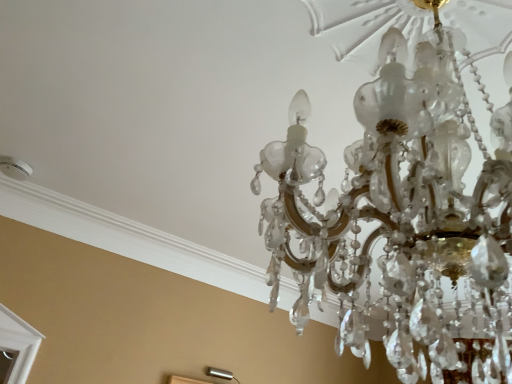
Question: Which direction should I rotate to look at silver metallic lamp at lower center, acting as the 2th lamp starting from the front, — up or down?

Choices:
 (A) up
 (B) down

Answer: (B)

Question: From the image's perspective, is silver metallic lamp at lower center, acting as the second lamp starting from the top, on top of clear crystal chandelier at upper center, the 2th lamp from the back?

Choices:
 (A) yes
 (B) no

Answer: (B)

Question: Does silver metallic lamp at lower center, the 1th lamp when ordered from bottom to top, have a greater width compared to clear crystal chandelier at upper center, which is counted as the 1th lamp, starting from the front?

Choices:
 (A) yes
 (B) no

Answer: (B)

Question: Is the position of silver metallic lamp at lower center, acting as the 2th lamp starting from the front, less distant than that of clear crystal chandelier at upper center, the first lamp when ordered from right to left?

Choices:
 (A) no
 (B) yes

Answer: (A)

Question: Can we say silver metallic lamp at lower center, acting as the 2th lamp starting from the right, lies outside clear crystal chandelier at upper center, the 2th lamp from the back?

Choices:
 (A) yes
 (B) no

Answer: (A)

Question: Is silver metallic lamp at lower center, the 1th lamp viewed from the left, smaller than clear crystal chandelier at upper center, the 2th lamp in the left-to-right sequence?

Choices:
 (A) no
 (B) yes

Answer: (B)

Question: From a real-world perspective, is silver metallic lamp at lower center, acting as the second lamp starting from the top, positioned under clear crystal chandelier at upper center, the 2th lamp in the left-to-right sequence, based on gravity?

Choices:
 (A) yes
 (B) no

Answer: (A)

Question: From the image's perspective, is clear crystal chandelier at upper center, which is counted as the second lamp, starting from the bottom, located beneath silver metallic lamp at lower center, the first lamp from the back?

Choices:
 (A) yes
 (B) no

Answer: (B)

Question: Considering the relative sizes of clear crystal chandelier at upper center, which is counted as the 1th lamp, starting from the front, and silver metallic lamp at lower center, acting as the 2th lamp starting from the front, in the image provided, is clear crystal chandelier at upper center, which is counted as the 1th lamp, starting from the front, wider than silver metallic lamp at lower center, acting as the 2th lamp starting from the front,?

Choices:
 (A) yes
 (B) no

Answer: (A)

Question: Does clear crystal chandelier at upper center, which is counted as the 1th lamp, starting from the front, have a smaller size compared to silver metallic lamp at lower center, acting as the 2th lamp starting from the right?

Choices:
 (A) yes
 (B) no

Answer: (B)

Question: From a real-world perspective, is clear crystal chandelier at upper center, the 2th lamp from the back, on silver metallic lamp at lower center, acting as the 2th lamp starting from the front?

Choices:
 (A) yes
 (B) no

Answer: (A)

Question: Could silver metallic lamp at lower center, the first lamp from the back, be considered to be inside clear crystal chandelier at upper center, which is counted as the 1th lamp, starting from the front?

Choices:
 (A) yes
 (B) no

Answer: (B)

Question: Is clear crystal chandelier at upper center, the 1th lamp from the top, looking in the opposite direction of silver metallic lamp at lower center, the 1th lamp when ordered from bottom to top?

Choices:
 (A) no
 (B) yes

Answer: (A)

Question: Would you say silver metallic lamp at lower center, the first lamp from the back, is inside or outside clear crystal chandelier at upper center, which is counted as the second lamp, starting from the bottom?

Choices:
 (A) outside
 (B) inside

Answer: (A)